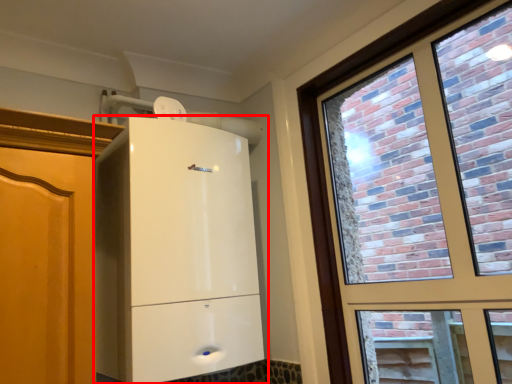
Question: Considering the relative positions of cupboard (annotated by the red box) and window in the image provided, where is cupboard (annotated by the red box) located with respect to the staircase?

Choices:
 (A) right
 (B) left

Answer: (B)